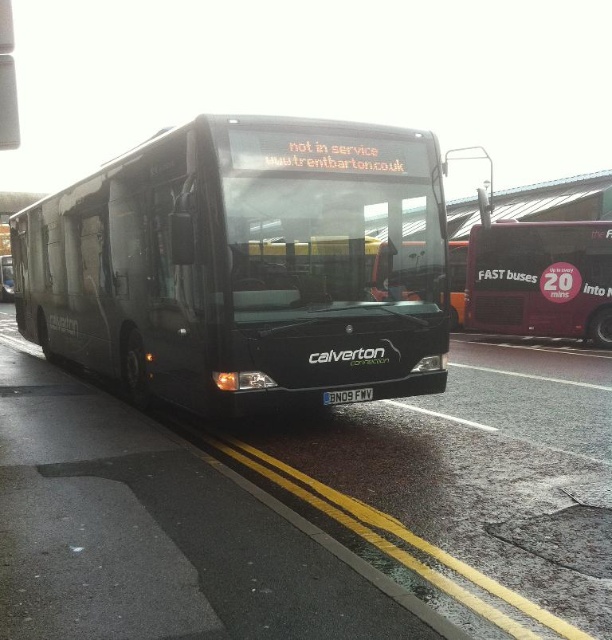
You are a pedestrian standing at the bus stop and want to board the first bus that arrives. Which bus should you wait near, the matte black bus at center or the maroon metallic bus at right, based on their positions?

The matte black bus at center is to the left of the maroon metallic bus at right. Since buses typically arrive from the left, you should wait near the matte black bus at center as it is positioned closer to the direction of incoming traffic.

You are a delivery person who needs to park your van between the maroon metallic bus at right and the black plastic license plate at center. The van is 2 meters wide. Can you fit your van between them?

The maroon metallic bus at right might be wider than the black plastic license plate at center, but without exact measurements, it is uncertain if there is enough space for the van. Please check the actual distance before attempting to park.